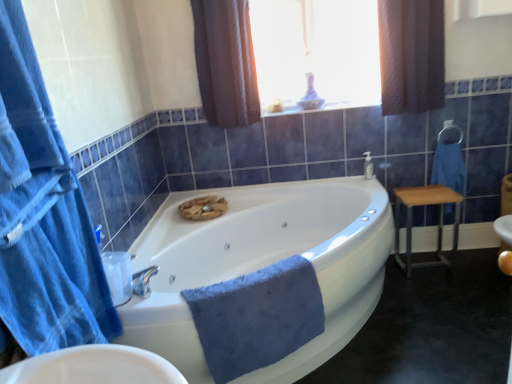
Question: Is white glossy bathtub at center closer to the viewer compared to wooden/metallic stool at right?

Choices:
 (A) yes
 (B) no

Answer: (A)

Question: Can you see white glossy bathtub at center touching wooden/metallic stool at right?

Choices:
 (A) no
 (B) yes

Answer: (A)

Question: From a real-world perspective, is white glossy bathtub at center below wooden/metallic stool at right?

Choices:
 (A) yes
 (B) no

Answer: (B)

Question: Does white glossy bathtub at center contain wooden/metallic stool at right?

Choices:
 (A) yes
 (B) no

Answer: (B)

Question: Is white glossy bathtub at center located outside wooden/metallic stool at right?

Choices:
 (A) no
 (B) yes

Answer: (B)

Question: From a real-world perspective, relative to translucent glass vase at upper center, is white glossy bathtub at center vertically above or below?

Choices:
 (A) above
 (B) below

Answer: (B)

Question: Considering the positions of white glossy bathtub at center and translucent glass vase at upper center in the image, is white glossy bathtub at center taller or shorter than translucent glass vase at upper center?

Choices:
 (A) tall
 (B) short

Answer: (B)

Question: From the image's perspective, relative to translucent glass vase at upper center, is white glossy bathtub at center above or below?

Choices:
 (A) above
 (B) below

Answer: (B)

Question: Relative to translucent glass vase at upper center, is white glossy bathtub at center in front or behind?

Choices:
 (A) front
 (B) behind

Answer: (A)

Question: Is blue soft towel at center, acting as the 2th bath towel starting from the top, situated inside brown textured curtain at upper center, which is counted as the second curtain, starting from the left, or outside?

Choices:
 (A) outside
 (B) inside

Answer: (A)

Question: Looking at the image, does blue soft towel at center, acting as the 2th bath towel starting from the top, seem bigger or smaller compared to brown textured curtain at upper center, which is the third curtain from front to back?

Choices:
 (A) small
 (B) big

Answer: (A)

Question: From the image's perspective, is blue soft towel at center, the second bath towel viewed from the back, positioned above or below brown textured curtain at upper center, which ranks as the 1th curtain in back-to-front order?

Choices:
 (A) above
 (B) below

Answer: (B)

Question: From their relative heights in the image, would you say blue soft towel at center, acting as the 2th bath towel starting from the top, is taller or shorter than brown textured curtain at upper center, which ranks as the 1th curtain in back-to-front order?

Choices:
 (A) short
 (B) tall

Answer: (A)

Question: Considering the positions of translucent glass vase at upper center and metallic silver towel bar at upper right in the image, is translucent glass vase at upper center wider or thinner than metallic silver towel bar at upper right?

Choices:
 (A) wide
 (B) thin

Answer: (B)

Question: Looking at the image, does translucent glass vase at upper center seem bigger or smaller compared to metallic silver towel bar at upper right?

Choices:
 (A) big
 (B) small

Answer: (A)